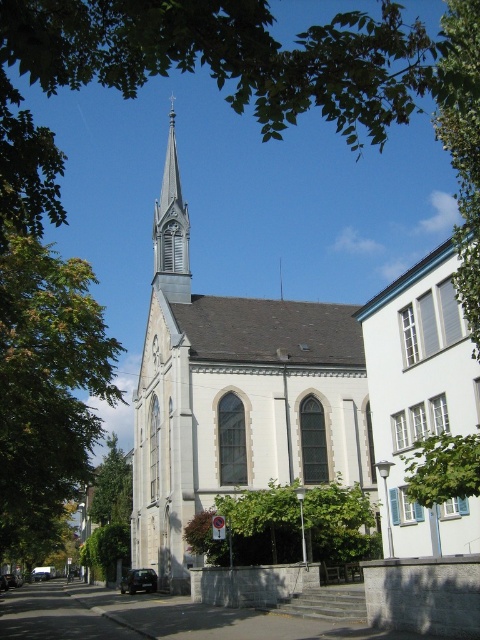
Question: Among these objects, which one is nearest to the camera?

Choices:
 (A) green leafy tree at lower left
 (B) gray stone spire at center

Answer: (B)

Question: Observing the image, what is the correct spatial positioning of white stone chapel at center in reference to green leafy tree at center?

Choices:
 (A) above
 (B) below

Answer: (A)

Question: Among these objects, which one is farthest from the camera?

Choices:
 (A) white stone chapel at center
 (B) gray stone spire at center
 (C) green leafy tree at left
 (D) green leafy tree at center

Answer: (B)

Question: Which object is the farthest from the white stone chapel at center?

Choices:
 (A) green leafy tree at left
 (B) green leafy tree at upper center

Answer: (B)

Question: Can you confirm if white stone chapel at center is wider than green leafy tree at left?

Choices:
 (A) no
 (B) yes

Answer: (A)

Question: Is white stone chapel at center above green leafy tree at center?

Choices:
 (A) yes
 (B) no

Answer: (A)